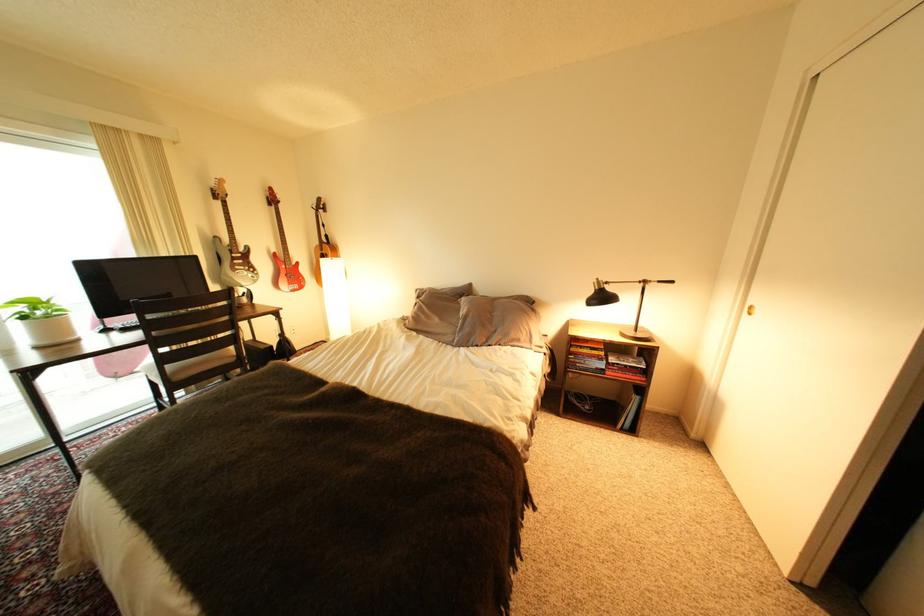
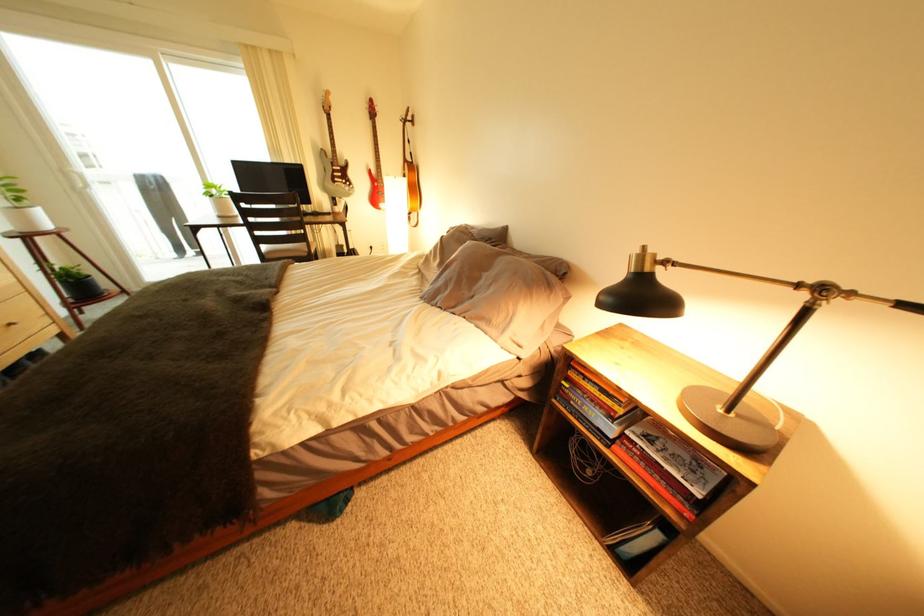
Where in the second image is the point corresponding to point 608,283 from the first image?

(650, 253)